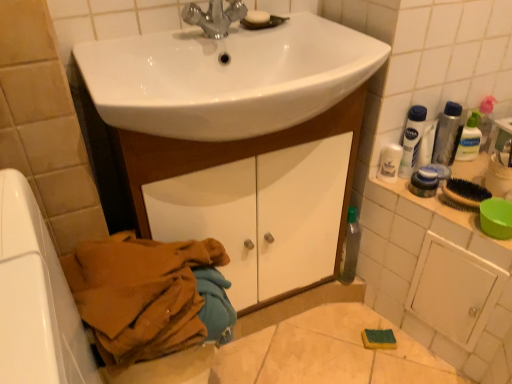
Question: Is clear plastic bottle at upper right, the 2th toiletry in the front-to-back sequence, looking in the opposite direction of white glossy cabinet at center?

Choices:
 (A) no
 (B) yes

Answer: (A)

Question: Is the position of clear plastic bottle at upper right, which appears as the 1th toiletry when viewed from the back, less distant than that of white glossy cabinet at center?

Choices:
 (A) no
 (B) yes

Answer: (A)

Question: Is clear plastic bottle at upper right, the 1th toiletry when ordered from right to left, behind white glossy cabinet at center?

Choices:
 (A) no
 (B) yes

Answer: (B)

Question: Can you confirm if clear plastic bottle at upper right, positioned as the first toiletry in top-to-bottom order, is positioned to the left of white glossy cabinet at center?

Choices:
 (A) yes
 (B) no

Answer: (B)

Question: Is clear plastic bottle at upper right, the 1th toiletry when ordered from right to left, far away from white glossy cabinet at center?

Choices:
 (A) no
 (B) yes

Answer: (A)

Question: From the image's perspective, is white matte soap at upper center positioned above or below white plastic bottle at upper right?

Choices:
 (A) above
 (B) below

Answer: (A)

Question: Is point (263, 18) positioned closer to the camera than point (416, 125)?

Choices:
 (A) farther
 (B) closer

Answer: (B)

Question: Considering the positions of white matte soap at upper center and white plastic bottle at upper right in the image, is white matte soap at upper center taller or shorter than white plastic bottle at upper right?

Choices:
 (A) tall
 (B) short

Answer: (B)

Question: Would you say white matte soap at upper center is to the left or to the right of white plastic bottle at upper right in the picture?

Choices:
 (A) left
 (B) right

Answer: (A)

Question: Is clear plastic bottle at upper right, positioned as the first toiletry in top-to-bottom order, inside the boundaries of brown fabric at lower left, or outside?

Choices:
 (A) outside
 (B) inside

Answer: (A)

Question: Is clear plastic bottle at upper right, which appears as the 1th toiletry when viewed from the back, to the left or to the right of brown fabric at lower left in the image?

Choices:
 (A) left
 (B) right

Answer: (B)

Question: Looking at the image, does clear plastic bottle at upper right, the 2th toiletry viewed from the left, seem bigger or smaller compared to brown fabric at lower left?

Choices:
 (A) big
 (B) small

Answer: (B)

Question: Is clear plastic bottle at upper right, the 2th toiletry in the front-to-back sequence, taller or shorter than brown fabric at lower left?

Choices:
 (A) tall
 (B) short

Answer: (B)

Question: Visually, is brown fabric at lower left positioned to the left or to the right of white glossy cabinet at center?

Choices:
 (A) left
 (B) right

Answer: (A)

Question: Relative to white glossy cabinet at center, is brown fabric at lower left in front or behind?

Choices:
 (A) behind
 (B) front

Answer: (B)